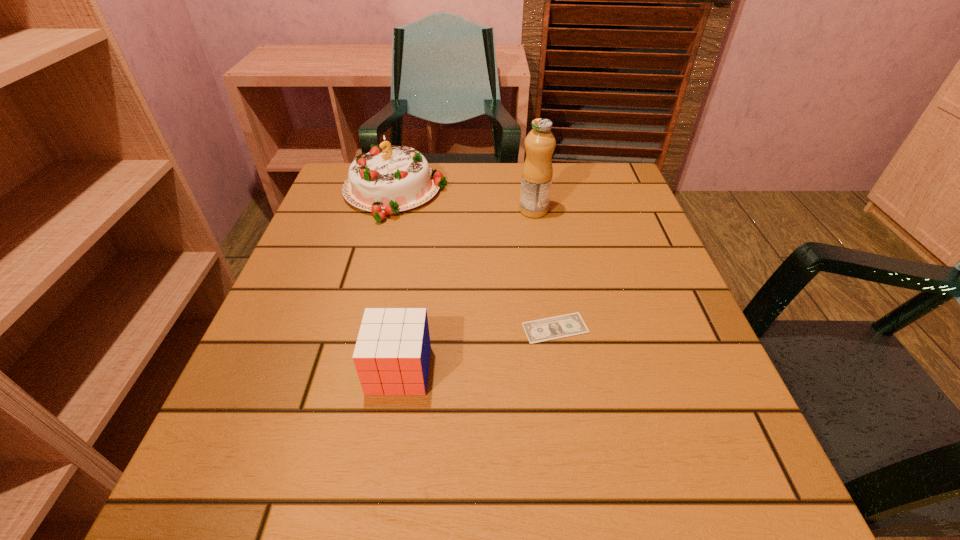
At what (x,y) coordinates should I click in order to perform the action: click on empty space that is in between the third farthest object and the nearest object. Please return your answer as a coordinate pair (x, y). This screenshot has width=960, height=540. Looking at the image, I should click on (477, 349).

At what (x,y) coordinates should I click in order to perform the action: click on the second closest object relative to the cake. Please return your answer as a coordinate pair (x, y). Looking at the image, I should click on (557, 327).

This screenshot has width=960, height=540. I want to click on object that is the closest one to the third farthest object, so click(392, 353).

Identify the location of free space that satisfies the following two spatial constraints: 1. on the front label of the tallest object; 2. on the front side of the second shortest object. (559, 370).

This screenshot has width=960, height=540. In order to click on free space that satisfies the following two spatial constraints: 1. on the front label of the fruit juice; 2. on the back side of the second nearest object in this screenshot , I will do `click(552, 328)`.

Locate an element on the screen. free location that satisfies the following two spatial constraints: 1. on the front label of the fruit juice; 2. on the front side of the cube is located at coordinates (559, 370).